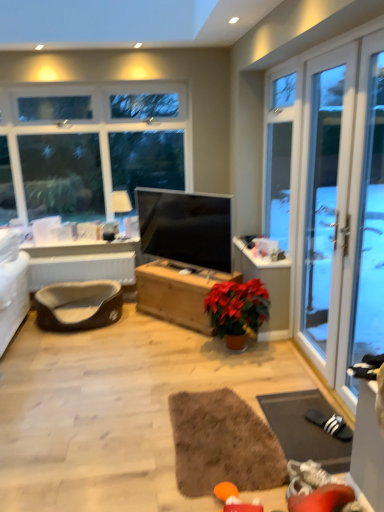
Locate an element on the screen. Image resolution: width=384 pixels, height=512 pixels. vacant space that's between brown plush pet bed at lower left and brown shaggy rug at center, which appears as the first yoga mat when viewed from the left is located at coordinates (126, 375).